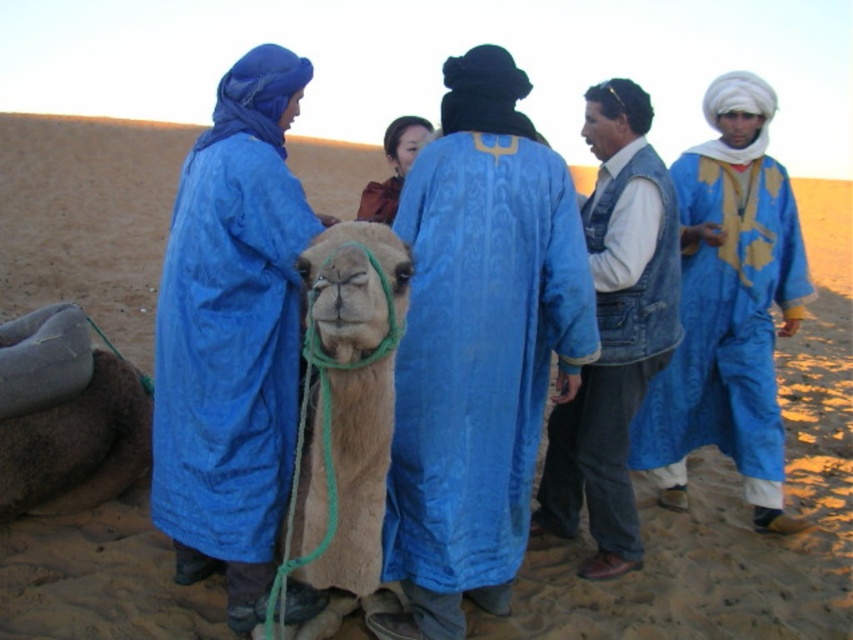
Is point (392, 616) closer to viewer compared to point (393, 304)?

No, (392, 616) is further to viewer.

Which is in front, point (494, 259) or point (374, 333)?

Point (374, 333)

Does point (511, 472) come in front of point (351, 408)?

No, it is not.

I want to click on velvet blue robe at center, so point(479,346).

Consider the image. Who is lower down, fuzzy beige camel at center or burgundy fabric bag at center?

Positioned lower is fuzzy beige camel at center.

The width and height of the screenshot is (853, 640). What do you see at coordinates (349, 403) in the screenshot? I see `fuzzy beige camel at center` at bounding box center [349, 403].

Between point (373, 449) and point (374, 204), which one is positioned behind?

Point (374, 204)

Locate an element on the screen. The image size is (853, 640). fuzzy beige camel at center is located at coordinates (349, 403).

Does blue velvet robe at right have a smaller size compared to smooth brown leather jacket at center?

No, blue velvet robe at right is not smaller than smooth brown leather jacket at center.

Is point (718, 224) positioned in front of point (392, 122)?

That is False.

Identify the location of blue velvet robe at right. (727, 323).